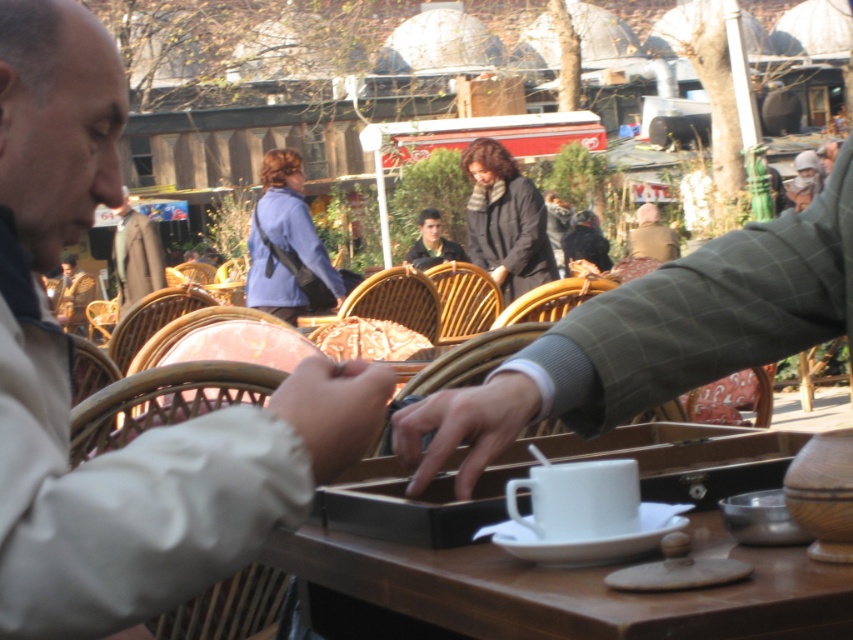
You are standing at the edge of the outdoor cafe scene. There is a point at coordinates (334, 410). Based on the description, what object is located at this point?

The point at coordinates (334, 410) is located on the fuzzy beige hand at center.

You are standing at the camera position and want to know how far the point at coordinates (120, 212) is from you. Please state the distance in meters.

The point at coordinates (120, 212) is 17.11 meters away from the camera.

In the scene shown: You are standing at the edge of the outdoor cafe scene. There is a point marked at coordinates [654,337]. What object or person is located at that point?

The point at coordinates [654,337] indicates the green plaid jacket at center.